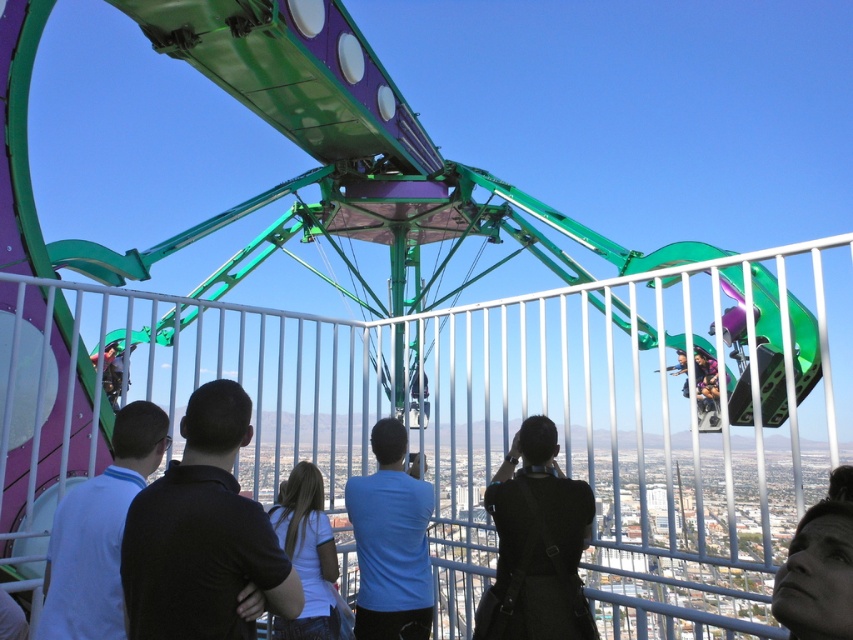
Does black fabric camera at center appear under white matte shirt at center?

No.

At what (x,y) coordinates should I click in order to perform the action: click on black fabric camera at center. Please return your answer as a coordinate pair (x, y). This screenshot has width=853, height=640. Looking at the image, I should click on (537, 545).

Who is more forward, (560, 554) or (318, 628)?

Point (318, 628)

The height and width of the screenshot is (640, 853). I want to click on black fabric camera at center, so click(x=537, y=545).

Does white shirt at left have a smaller size compared to blue matte shirt at center?

Yes, white shirt at left is smaller than blue matte shirt at center.

Between white shirt at left and blue matte shirt at center, which one is positioned lower?

blue matte shirt at center

What do you see at coordinates (97, 532) in the screenshot? I see `white shirt at left` at bounding box center [97, 532].

Where is `white shirt at left`? white shirt at left is located at coordinates (97, 532).

Can you confirm if black shirt at center is positioned below smooth skin face at lower right?

No.

How distant is black shirt at center from smooth skin face at lower right?

black shirt at center is 50.16 meters from smooth skin face at lower right.

At what (x,y) coordinates should I click in order to perform the action: click on black shirt at center. Please return your answer as a coordinate pair (x, y). Looking at the image, I should click on (202, 536).